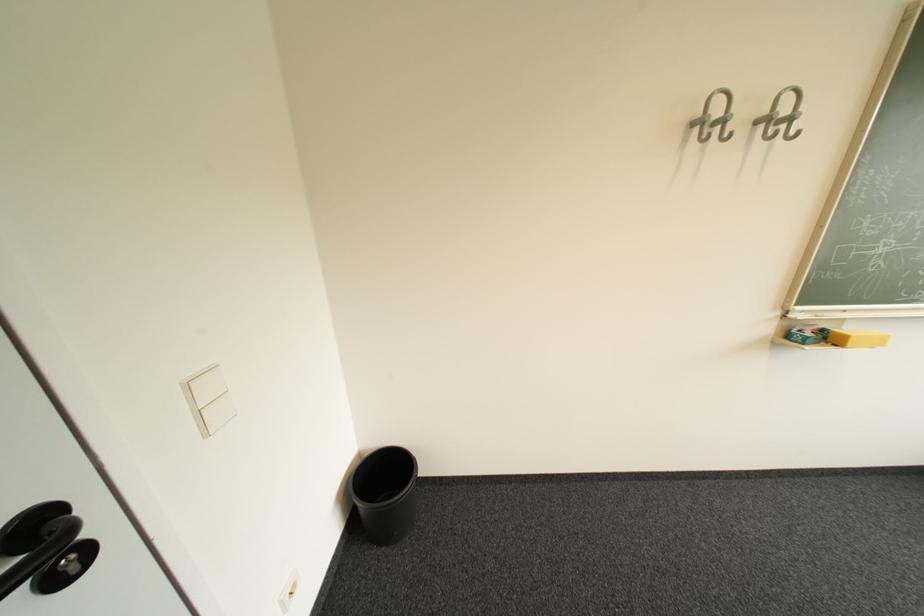
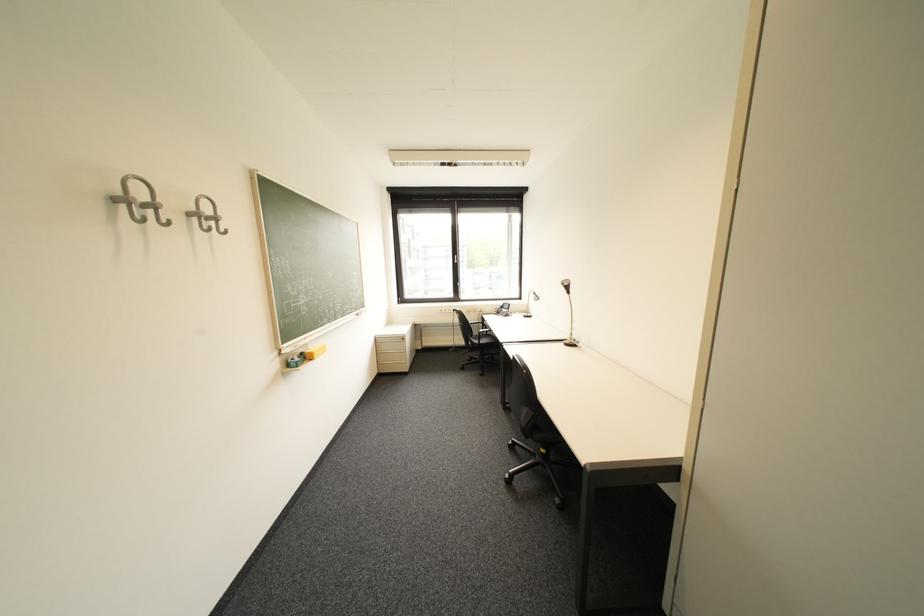
In the second image, find the point that corresponds to the point at 820,334 in the first image.

(308, 360)